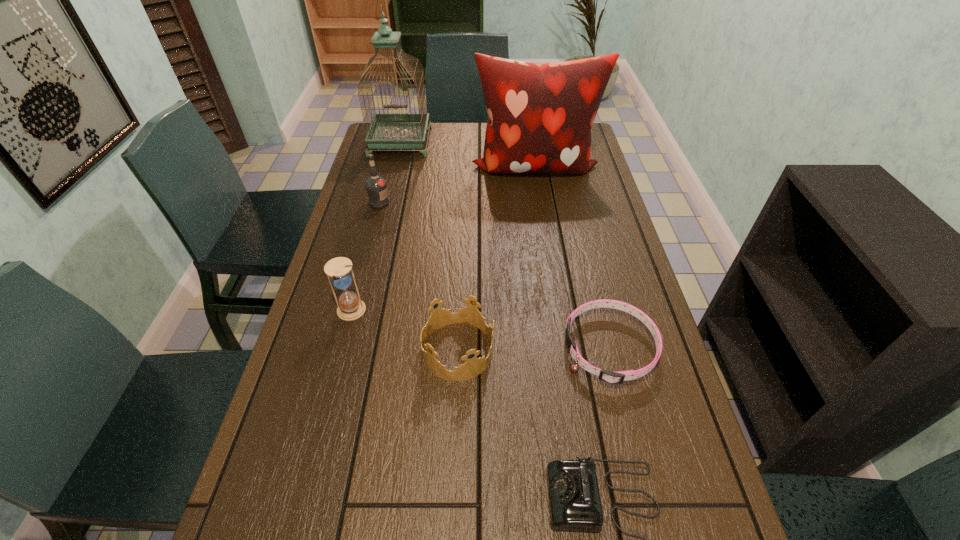
At what (x,y) coordinates should I click in order to perform the action: click on vacant area situated on the front-facing side of the tiara. Please return your answer as a coordinate pair (x, y). Looking at the image, I should click on (589, 350).

At what (x,y) coordinates should I click in order to perform the action: click on free space located with the buckle on the dog collar. Please return your answer as a coordinate pair (x, y). Looking at the image, I should click on coord(426,348).

Where is `vacant space located with the buckle on the dog collar`? The image size is (960, 540). vacant space located with the buckle on the dog collar is located at coordinates (435, 348).

Locate an element on the screen. The width and height of the screenshot is (960, 540). free space located 0.220m with the buckle on the dog collar is located at coordinates (472, 348).

At what (x,y) coordinates should I click in order to perform the action: click on birdcage that is at the far edge. Please return your answer as a coordinate pair (x, y). This screenshot has width=960, height=540. Looking at the image, I should click on (387, 130).

Where is `cushion present at the far edge`? This screenshot has height=540, width=960. cushion present at the far edge is located at coordinates (540, 116).

Locate an element on the screen. The height and width of the screenshot is (540, 960). birdcage present at the left edge is located at coordinates (387, 130).

Where is `vodka positioned at the left edge`? The image size is (960, 540). vodka positioned at the left edge is located at coordinates (376, 186).

The image size is (960, 540). Find the location of `hourglass present at the left edge`. hourglass present at the left edge is located at coordinates (350, 307).

In order to click on cushion at the right edge in this screenshot , I will do `click(540, 116)`.